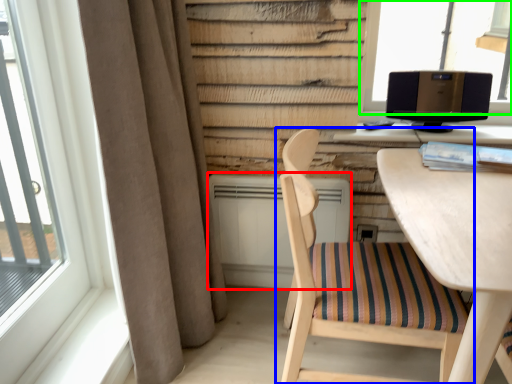
Question: Considering the real-world distances, which object is farthest from air conditioner (highlighted by a red box)? chair (highlighted by a blue box) or window (highlighted by a green box)?

Choices:
 (A) chair
 (B) window

Answer: (B)